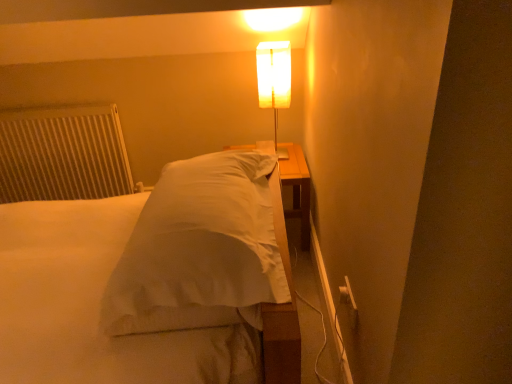
Locate an element on the screen. This screenshot has width=512, height=384. empty space that is ontop of white textured radiator at left (from a real-world perspective) is located at coordinates (48, 112).